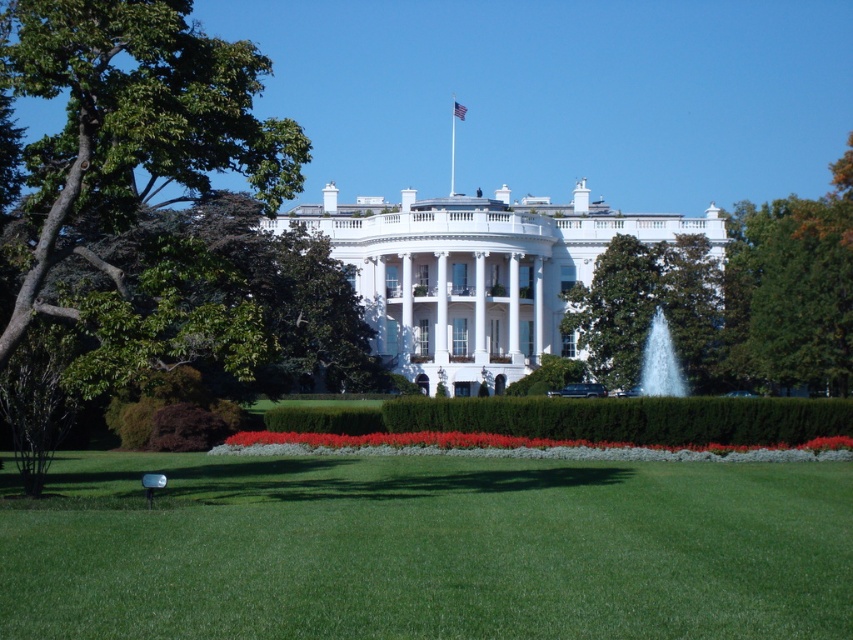
You are a landscape architect designing a walking path between the green leafy tree at center and the clear glass fountain at center. If the path must be at least 3 meters wide to accommodate visitors comfortably, can the existing space between them accommodate this requirement?

The distance between the green leafy tree at center and the clear glass fountain at center is 4.48 meters. Since the required path width is 3 meters, the existing space of 4.48 meters is sufficient to accommodate the path.

You are a landscape architect designing a new pathway between the green leafy tree at right and the clear glass fountain at center. Based on their widths, which object should you consider placing closer to the pathway to avoid blocking it?

The green leafy tree at right might be wider than the clear glass fountain at center, so placing the fountain closer to the pathway would be better to avoid blocking it due to the tree potentially having a larger width.

You are standing in front of the White House and want to take a photo that includes both the green leafy tree at right and the clear glass fountain at center. Which object should you position closer to the camera to ensure both are in focus?

To ensure both the green leafy tree at right and the clear glass fountain at center are in focus, position the camera closer to the green leafy tree at right since it is nearer to the viewer than the clear glass fountain at center. This will help achieve a deeper depth of field for both objects.